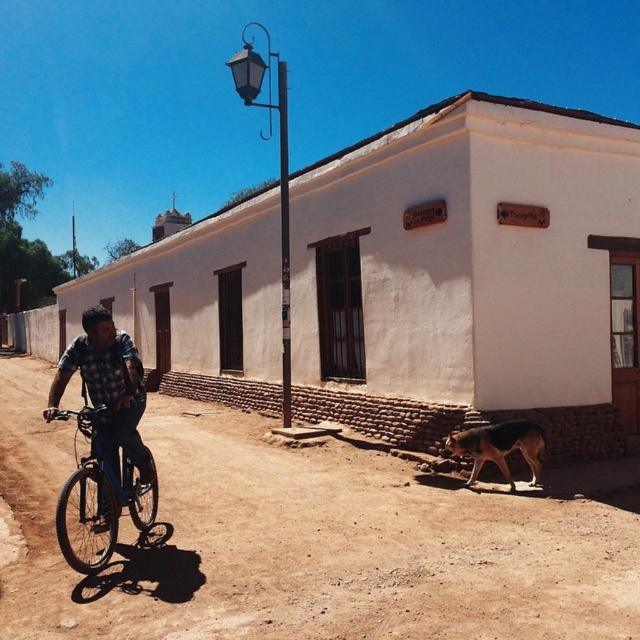
You are standing at the origin point of the image. Which direction should you walk to reach the checkered fabric shirt at left?

Since the checkered fabric shirt at left is located at coordinate point 0.611 on the x axis and 0.169 on the y axis, you should walk towards the left and slightly downward direction to reach it.